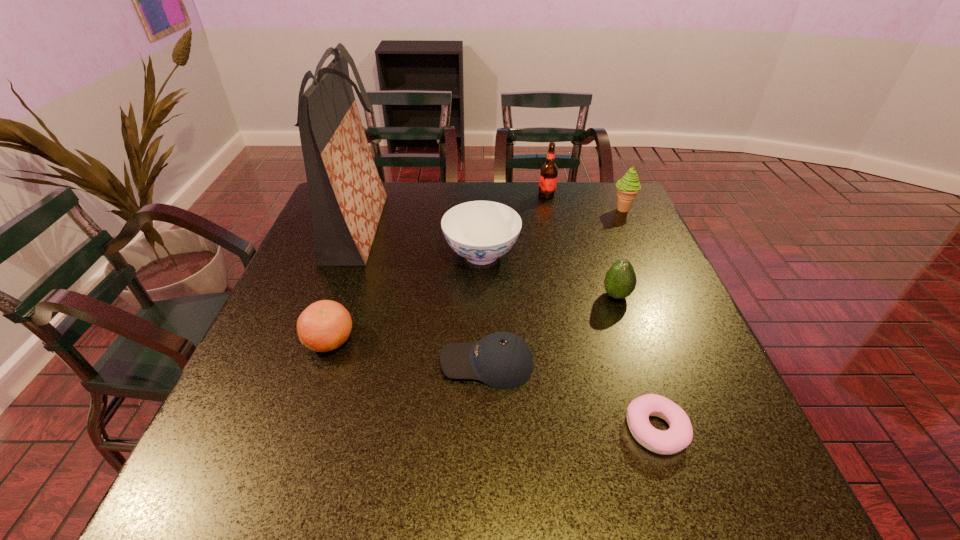
You are a GUI agent. You are given a task and a screenshot of the screen. Output one action in this format:
    pyautogui.click(x=<x>, y=<y>)
    Task: Click on the blank space located 0.160m on the front-facing side of the shopping bag
    This screenshot has width=960, height=540.
    Given the screenshot: What is the action you would take?
    pyautogui.click(x=446, y=228)

This screenshot has height=540, width=960. I want to click on free space located 0.160m on the front of the fourth object from right to left, so [x=554, y=228].

In order to click on vacant space located on the back of the third tallest object in this screenshot , I will do `click(615, 193)`.

Find the location of a particular element. free space located on the left of the fifth farthest object is located at coordinates tap(556, 295).

Where is `vacant region located 0.210m on the back of the chinaware`? The height and width of the screenshot is (540, 960). vacant region located 0.210m on the back of the chinaware is located at coordinates pos(481,195).

Find the location of a particular element. free spot located on the right of the sixth tallest object is located at coordinates (382, 340).

Locate an element on the screen. free spot located on the front-facing side of the baseball cap is located at coordinates 320,363.

Where is `vacant space positioned 0.070m on the front-facing side of the baseball cap`? vacant space positioned 0.070m on the front-facing side of the baseball cap is located at coordinates (407, 363).

At what (x,y) coordinates should I click in order to perform the action: click on vacant space located on the front-facing side of the baseball cap. Please return your answer as a coordinate pair (x, y). This screenshot has height=540, width=960. Looking at the image, I should click on (262, 363).

At what (x,y) coordinates should I click in order to perform the action: click on free space located 0.320m on the back of the pastry. Please return your answer as a coordinate pair (x, y). The image size is (960, 540). Looking at the image, I should click on (611, 290).